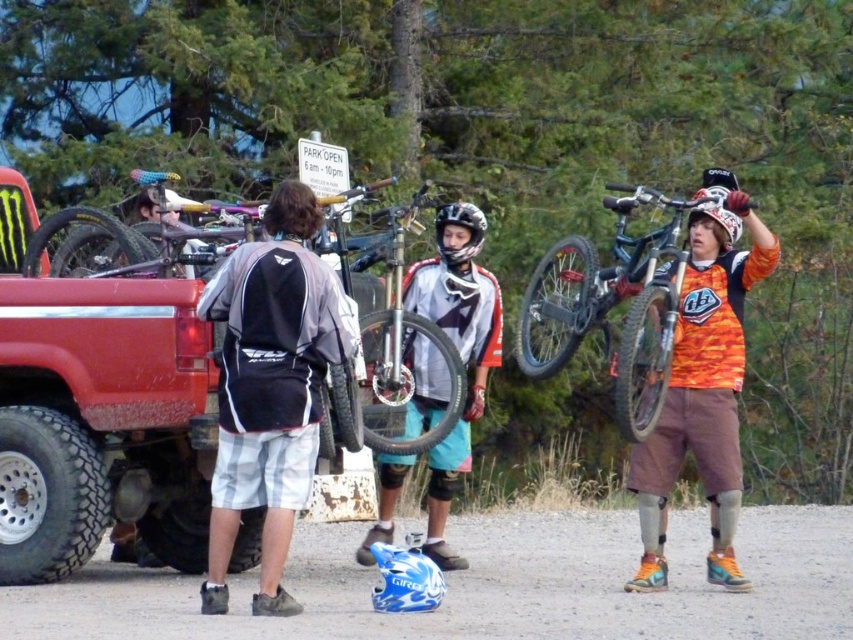
Question: Among these points, which one is nearest to the camera?

Choices:
 (A) (442, 323)
 (B) (453, 205)
 (C) (306, 193)

Answer: (C)

Question: Which object appears farthest from the camera in this image?

Choices:
 (A) gray fabric backpack at center
 (B) matte black helmet at center

Answer: (B)

Question: Does matte white jersey at center have a larger size compared to brown hair at center?

Choices:
 (A) no
 (B) yes

Answer: (B)

Question: Observing the image, what is the correct spatial positioning of orange/textured shirt at center in reference to matte black helmet at center?

Choices:
 (A) left
 (B) right

Answer: (B)

Question: Is gray fabric backpack at center thinner than matte white jersey at center?

Choices:
 (A) yes
 (B) no

Answer: (A)

Question: Which of these objects is positioned closest to the matte black helmet at center?

Choices:
 (A) shiny metallic bicycle at upper right
 (B) matte white jersey at center

Answer: (B)